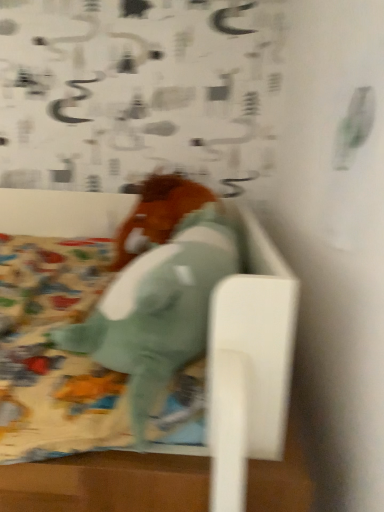
Question: Considering the relative positions of soft teal plush horse at center, which ranks as the 1th animal in front-to-back order, and brown matte horse at center, the 2th animal positioned from the front, in the image provided, is soft teal plush horse at center, which ranks as the 1th animal in front-to-back order, to the left or to the right of brown matte horse at center, the 2th animal positioned from the front,?

Choices:
 (A) right
 (B) left

Answer: (A)

Question: From a real-world perspective, is soft teal plush horse at center, the second animal from the back, positioned above or below brown matte horse at center, the first animal when ordered from back to front?

Choices:
 (A) below
 (B) above

Answer: (A)

Question: In the image, is soft teal plush horse at center, the second animal from the back, positioned in front of or behind brown matte horse at center, the first animal when ordered from back to front?

Choices:
 (A) front
 (B) behind

Answer: (A)

Question: Considering their positions, is brown matte horse at center, the 2th animal positioned from the front, located in front of or behind soft teal plush horse at center, the second animal from the back?

Choices:
 (A) front
 (B) behind

Answer: (B)

Question: From the image's perspective, is brown matte horse at center, the 2th animal positioned from the front, located above or below soft teal plush horse at center, the second animal from the back?

Choices:
 (A) above
 (B) below

Answer: (A)

Question: Is brown matte horse at center, the first animal when ordered from back to front, taller or shorter than soft teal plush horse at center, the second animal from the back?

Choices:
 (A) tall
 (B) short

Answer: (A)

Question: Would you say brown matte horse at center, the first animal when ordered from back to front, is to the left or to the right of soft teal plush horse at center, the second animal from the back, in the picture?

Choices:
 (A) left
 (B) right

Answer: (A)